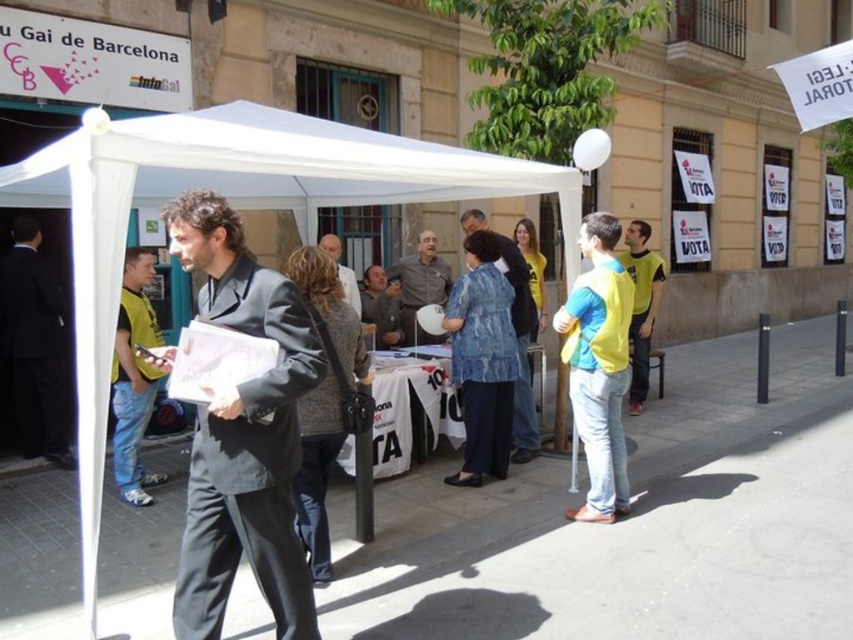
Which of these two, white fabric canopy at center or yellow matte shirt at center, stands taller?

With more height is white fabric canopy at center.

Can you confirm if white fabric canopy at center is positioned to the right of yellow matte shirt at center?

No, white fabric canopy at center is not to the right of yellow matte shirt at center.

Locate an element on the screen. The width and height of the screenshot is (853, 640). white fabric canopy at center is located at coordinates 234,205.

The image size is (853, 640). What do you see at coordinates (520, 349) in the screenshot? I see `denim jacket at center` at bounding box center [520, 349].

Who is taller, denim jacket at center or matte gray shirt at center?

denim jacket at center

This screenshot has width=853, height=640. I want to click on denim jacket at center, so click(520, 349).

I want to click on denim jacket at center, so click(x=520, y=349).

Describe the element at coordinates (248, 464) in the screenshot. I see `dark gray wool suit at center` at that location.

Is the position of dark gray wool suit at center more distant than that of yellow matte shirt at center?

No, it is in front of yellow matte shirt at center.

Where is `dark gray wool suit at center`? dark gray wool suit at center is located at coordinates (248, 464).